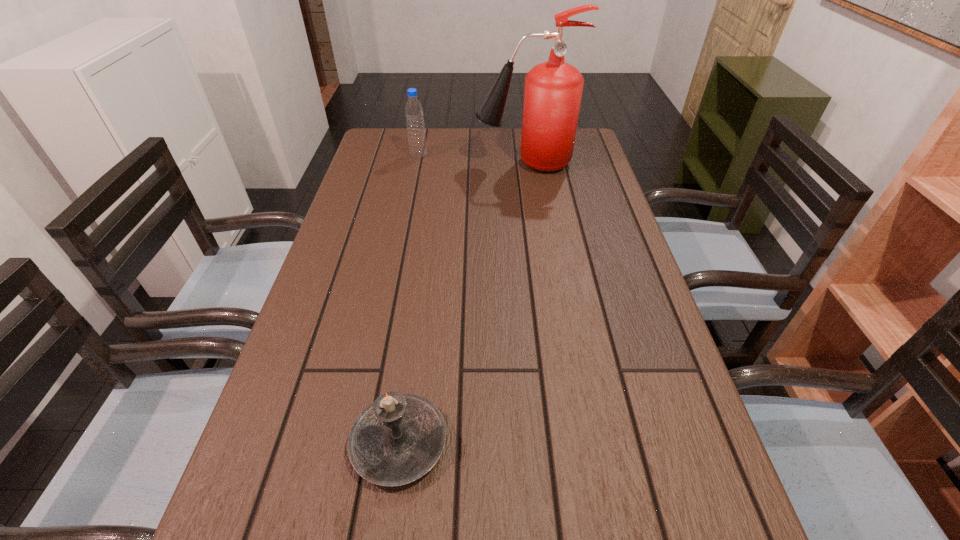
I want to click on fire extinguisher that is positioned at the far edge, so click(553, 89).

What are the coordinates of `water bottle that is at the far edge` in the screenshot? It's located at pos(417,144).

Where is `water bottle that is at the left edge`? This screenshot has width=960, height=540. water bottle that is at the left edge is located at coordinates (417, 144).

Image resolution: width=960 pixels, height=540 pixels. Identify the location of candle at the left edge. coord(397,439).

Find the location of a particular element. Image resolution: width=960 pixels, height=540 pixels. object located at the right edge is located at coordinates (553, 89).

The width and height of the screenshot is (960, 540). I want to click on object that is at the far left corner, so click(417, 144).

The image size is (960, 540). What are the coordinates of `object that is at the far right corner` in the screenshot? It's located at (553, 89).

Find the location of a particular element. vacant area at the far edge is located at coordinates (516, 142).

The image size is (960, 540). I want to click on free space at the left edge of the desktop, so coord(406,191).

In the image, there is a desktop. Identify the location of free space at the right edge. The image size is (960, 540). (600, 251).